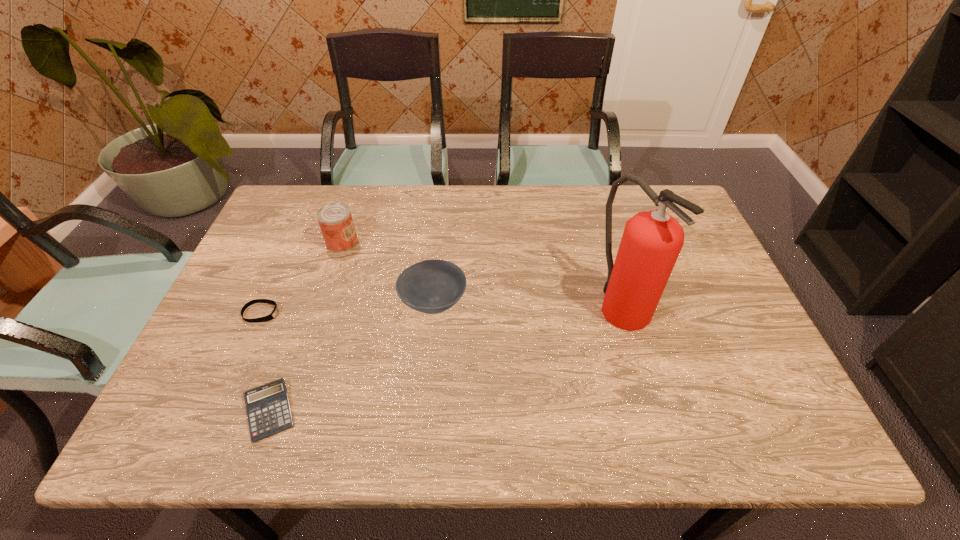
The image size is (960, 540). Identify the location of object that is the closest to the fire extinguisher. (432, 286).

Identify which object is the closest to the leftmost object. Please provide its 2D coordinates. Your answer should be formatted as a tuple, i.e. [(x, y)], where the tuple contains the x and y coordinates of a point satisfying the conditions above.

[(268, 409)]

This screenshot has height=540, width=960. I want to click on vacant space that satisfies the following two spatial constraints: 1. on the handle side of the rightmost object; 2. on the display of the leftmost object, so pyautogui.click(x=625, y=313).

Where is `vacant region that satisfies the following two spatial constraints: 1. on the display of the nearest object; 2. on the left side of the leftmost object`? vacant region that satisfies the following two spatial constraints: 1. on the display of the nearest object; 2. on the left side of the leftmost object is located at coordinates (218, 411).

You are a GUI agent. You are given a task and a screenshot of the screen. Output one action in this format:
    pyautogui.click(x=<x>, y=<y>)
    Task: Click on the vacant position in the image that satisfies the following two spatial constraints: 1. on the front side of the can; 2. on the left side of the fourth object from left to right
    Image resolution: width=960 pixels, height=540 pixels.
    Given the screenshot: What is the action you would take?
    pyautogui.click(x=323, y=302)

Image resolution: width=960 pixels, height=540 pixels. What are the coordinates of `vacant area in the image that satisfies the following two spatial constraints: 1. on the display of the leftmost object; 2. on the right side of the calculator` in the screenshot? It's located at (218, 411).